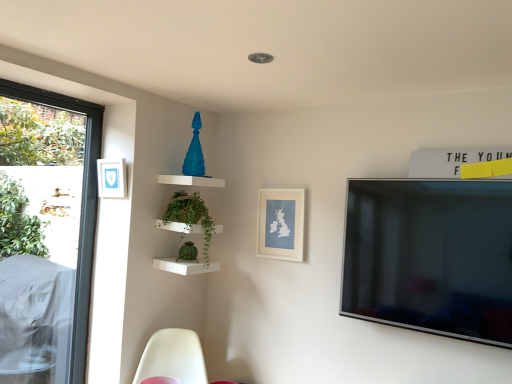
Question: Is point (76, 264) closer or farther from the camera than point (289, 215)?

Choices:
 (A) closer
 (B) farther

Answer: (B)

Question: Is transparent glass window at left wider or thinner than white matte picture frame at center, placed as the second picture frame when sorted from left to right?

Choices:
 (A) wide
 (B) thin

Answer: (A)

Question: Which object is the closest to the white matte picture frame at center, which ranks as the 1th picture frame in bottom-to-top order?

Choices:
 (A) blue matte picture frame at upper left, which appears as the 1th picture frame when viewed from the left
 (B) green wicker basket at upper center
 (C) transparent glass window at left
 (D) white plastic swivel chair at lower left

Answer: (B)

Question: Which of these objects is positioned closest to the transparent glass window at left?

Choices:
 (A) white plastic swivel chair at lower left
 (B) blue matte picture frame at upper left, which is the second picture frame in right-to-left order
 (C) white matte picture frame at center, which is counted as the second picture frame, starting from the front
 (D) green wicker basket at upper center

Answer: (B)